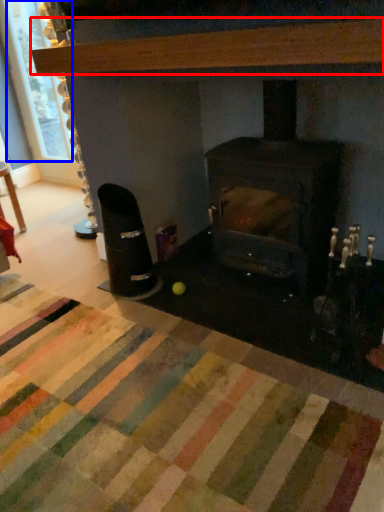
Question: Which of the following is the closest to the observer, hardwood (highlighted by a red box) or window screen (highlighted by a blue box)?

Choices:
 (A) hardwood
 (B) window screen

Answer: (A)